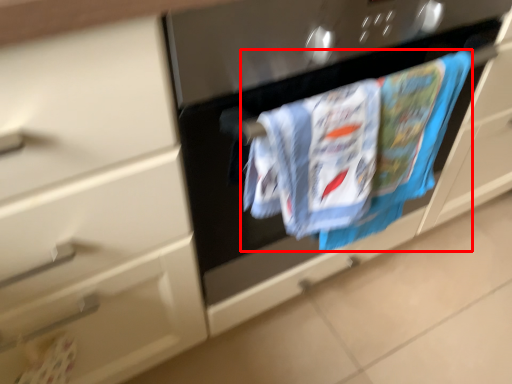
Question: From the image, what is the correct spatial relationship of laundry (annotated by the red box) in relation to door handle?

Choices:
 (A) right
 (B) left

Answer: (A)